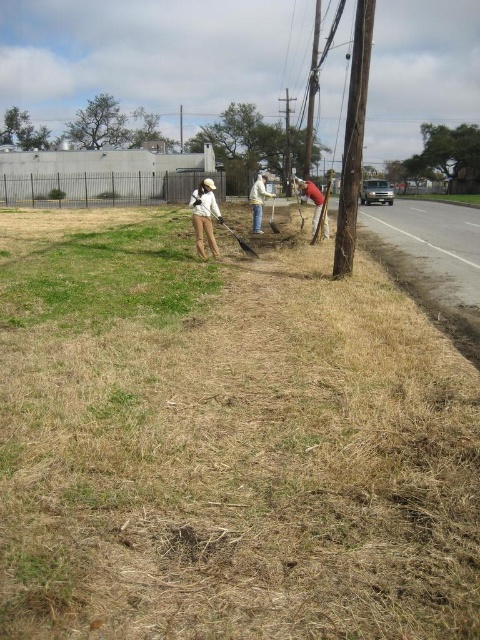
Question: Considering the real-world distances, which object is farthest from the brown dry grass at center?

Choices:
 (A) white matte shirt at center
 (B) light brown fabric shirt at center
 (C) wooden utility pole at upper right

Answer: (A)

Question: Does wooden utility pole at upper right appear on the left side of light brown fabric shirt at center?

Choices:
 (A) yes
 (B) no

Answer: (B)

Question: Which is nearer to the light brown fabric shirt at center?

Choices:
 (A) matte red fire hydrant at center
 (B) wooden utility pole at upper right
 (C) brown dry grass at lower right
 (D) dark brown wooden shovel at center

Answer: (B)

Question: Considering the relative positions of light brown fabric shirt at center and brown dry grass at lower right in the image provided, where is light brown fabric shirt at center located with respect to brown dry grass at lower right?

Choices:
 (A) left
 (B) right

Answer: (A)

Question: Which object is the farthest from the white matte shirt at center?

Choices:
 (A) brown dry grass at center
 (B) dark brown wooden shovel at center
 (C) matte red fire hydrant at center

Answer: (A)

Question: Where is wooden utility pole at upper right located in relation to brown dry grass at lower right in the image?

Choices:
 (A) right
 (B) left

Answer: (B)